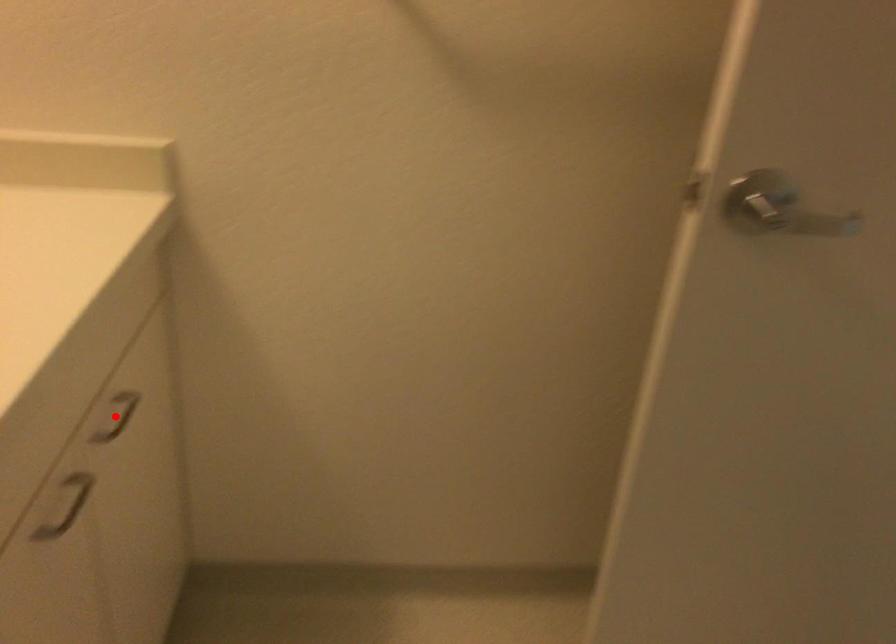
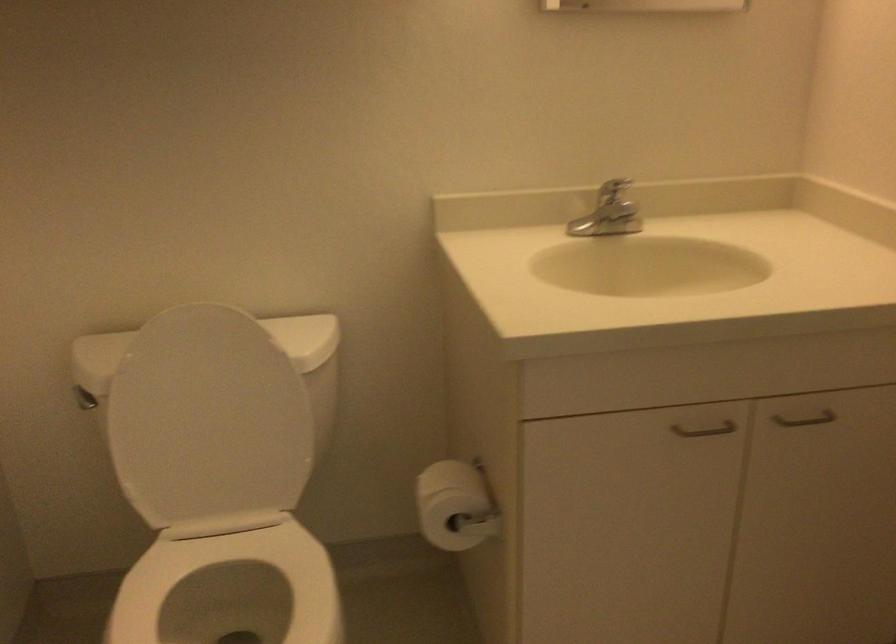
Question: I am providing you with two images of the same scene from different viewpoints. A red point is marked on the first image. Can you still see the location of the red point in image 2?

Choices:
 (A) Yes
 (B) No

Answer: (B)